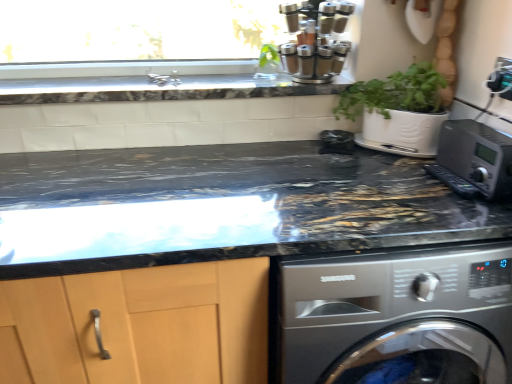
Question: Considering the relative sizes of black marble countertop at upper center, which is the first countertop from top to bottom, and green leafy plant at upper center in the image provided, is black marble countertop at upper center, which is the first countertop from top to bottom, taller than green leafy plant at upper center?

Choices:
 (A) no
 (B) yes

Answer: (A)

Question: Is black marble countertop at upper center, which is the first countertop from top to bottom, smaller than green leafy plant at upper center?

Choices:
 (A) yes
 (B) no

Answer: (B)

Question: Is black marble countertop at upper center, marked as the 2th countertop in a bottom-to-top arrangement, aimed at green leafy plant at upper center?

Choices:
 (A) no
 (B) yes

Answer: (A)

Question: Does black marble countertop at upper center, marked as the 2th countertop in a bottom-to-top arrangement, lie behind green leafy plant at upper center?

Choices:
 (A) no
 (B) yes

Answer: (A)

Question: Is black marble countertop at upper center, marked as the 2th countertop in a bottom-to-top arrangement, looking in the opposite direction of green leafy plant at upper center?

Choices:
 (A) no
 (B) yes

Answer: (A)

Question: Is black marble countertop at upper center, which is the first countertop from top to bottom, inside the boundaries of green leafy plant at upper center, or outside?

Choices:
 (A) inside
 (B) outside

Answer: (B)

Question: Based on their sizes in the image, would you say black marble countertop at upper center, which is the first countertop from top to bottom, is bigger or smaller than green leafy plant at upper center?

Choices:
 (A) small
 (B) big

Answer: (B)

Question: Based on their positions, is black marble countertop at upper center, marked as the 2th countertop in a bottom-to-top arrangement, located to the left or right of green leafy plant at upper center?

Choices:
 (A) right
 (B) left

Answer: (B)

Question: Relative to green leafy plant at upper center, is black marble countertop at upper center, marked as the 2th countertop in a bottom-to-top arrangement, in front or behind?

Choices:
 (A) behind
 (B) front

Answer: (B)

Question: Is green leafy plant at upper center taller or shorter than metallic silver microwave at right?

Choices:
 (A) tall
 (B) short

Answer: (B)

Question: From a real-world perspective, relative to metallic silver microwave at right, is green leafy plant at upper center vertically above or below?

Choices:
 (A) above
 (B) below

Answer: (A)

Question: Looking at their shapes, would you say green leafy plant at upper center is wider or thinner than metallic silver microwave at right?

Choices:
 (A) wide
 (B) thin

Answer: (B)

Question: From the image's perspective, is green leafy plant at upper center positioned above or below metallic silver microwave at right?

Choices:
 (A) above
 (B) below

Answer: (A)

Question: Is satin silver spice rack at upper center taller or shorter than metallic silver microwave at right?

Choices:
 (A) short
 (B) tall

Answer: (B)

Question: Would you say satin silver spice rack at upper center is to the left or to the right of metallic silver microwave at right in the picture?

Choices:
 (A) left
 (B) right

Answer: (A)